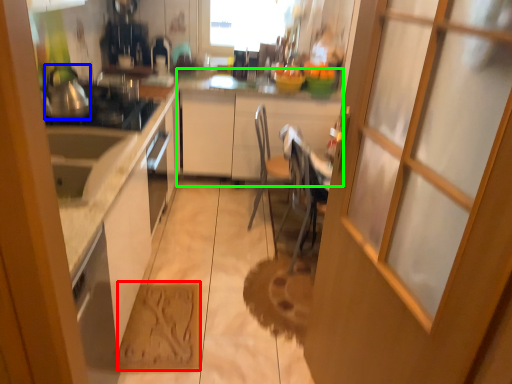
Question: Which object is positioned farthest from cardboard (highlighted by a red box)? Select from tea pot (highlighted by a blue box) and cabinetry (highlighted by a green box).

Choices:
 (A) tea pot
 (B) cabinetry

Answer: (B)